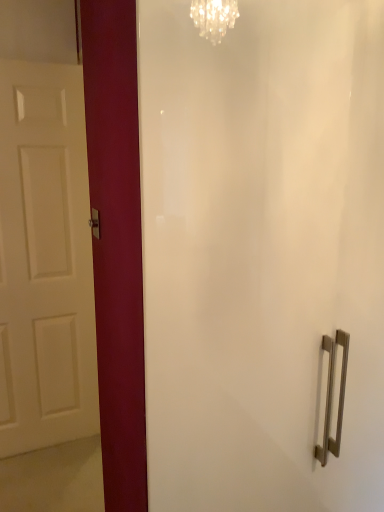
Question: Is satin nickel door handle at center-left positioned far away from white matte door at left?

Choices:
 (A) yes
 (B) no

Answer: (B)

Question: Can you confirm if satin nickel door handle at center-left is bigger than white matte door at left?

Choices:
 (A) no
 (B) yes

Answer: (A)

Question: Considering the relative sizes of satin nickel door handle at center-left and white matte door at left in the image provided, is satin nickel door handle at center-left shorter than white matte door at left?

Choices:
 (A) no
 (B) yes

Answer: (B)

Question: Considering the relative positions of satin nickel door handle at center-left and white matte door at left in the image provided, is satin nickel door handle at center-left in front of white matte door at left?

Choices:
 (A) yes
 (B) no

Answer: (A)

Question: Is satin nickel door handle at center-left positioned beyond the bounds of white matte door at left?

Choices:
 (A) yes
 (B) no

Answer: (A)

Question: Is satin nickel door handle at center-left facing away from white matte door at left?

Choices:
 (A) yes
 (B) no

Answer: (B)

Question: Does white matte door at left have a greater width compared to satin nickel door handle at center-left?

Choices:
 (A) yes
 (B) no

Answer: (A)

Question: Does white matte door at left have a larger size compared to satin nickel door handle at center-left?

Choices:
 (A) yes
 (B) no

Answer: (A)

Question: From the image's perspective, is white matte door at left over satin nickel door handle at center-left?

Choices:
 (A) yes
 (B) no

Answer: (A)

Question: Is white matte door at left oriented away from satin nickel door handle at center-left?

Choices:
 (A) yes
 (B) no

Answer: (B)

Question: Can you confirm if white matte door at left is positioned to the right of satin nickel door handle at center-left?

Choices:
 (A) yes
 (B) no

Answer: (B)

Question: Considering the relative sizes of white matte door at left and satin nickel door handle at center-left in the image provided, is white matte door at left thinner than satin nickel door handle at center-left?

Choices:
 (A) yes
 (B) no

Answer: (B)

Question: Visually, is satin nickel door handle at center-left positioned to the left or to the right of white matte door at left?

Choices:
 (A) left
 (B) right

Answer: (B)